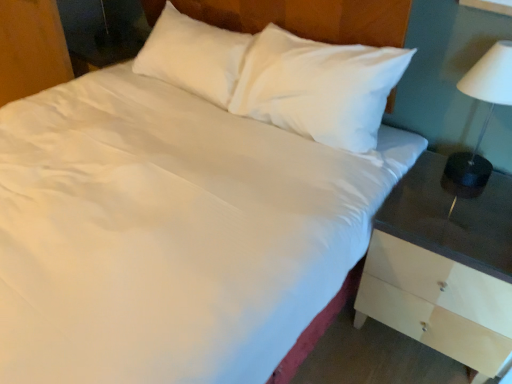
Question: Can we say wooden dresser at lower left lies outside white glossy lampshade at right?

Choices:
 (A) yes
 (B) no

Answer: (A)

Question: Is wooden dresser at lower left further to the viewer compared to white glossy lampshade at right?

Choices:
 (A) no
 (B) yes

Answer: (B)

Question: From the image's perspective, is wooden dresser at lower left under white glossy lampshade at right?

Choices:
 (A) no
 (B) yes

Answer: (A)

Question: Does wooden dresser at lower left have a lesser width compared to white glossy lampshade at right?

Choices:
 (A) yes
 (B) no

Answer: (A)

Question: Is wooden dresser at lower left smaller than white glossy lampshade at right?

Choices:
 (A) yes
 (B) no

Answer: (B)

Question: In the image, is white glossy lampshade at right positioned in front of or behind wooden dresser at lower left?

Choices:
 (A) front
 (B) behind

Answer: (A)

Question: In terms of width, does white glossy lampshade at right look wider or thinner when compared to wooden dresser at lower left?

Choices:
 (A) wide
 (B) thin

Answer: (A)

Question: Considering the positions of white glossy lampshade at right and wooden dresser at lower left in the image, is white glossy lampshade at right taller or shorter than wooden dresser at lower left?

Choices:
 (A) short
 (B) tall

Answer: (A)

Question: Considering the relative positions of white glossy lampshade at right and wooden dresser at lower left in the image provided, is white glossy lampshade at right to the left or to the right of wooden dresser at lower left?

Choices:
 (A) right
 (B) left

Answer: (A)

Question: Considering the positions of point (392, 210) and point (44, 76), is point (392, 210) closer or farther from the camera than point (44, 76)?

Choices:
 (A) farther
 (B) closer

Answer: (B)

Question: Considering the positions of white wood nightstand at right and wooden dresser at lower left in the image, is white wood nightstand at right taller or shorter than wooden dresser at lower left?

Choices:
 (A) tall
 (B) short

Answer: (B)

Question: Is white wood nightstand at right wider or thinner than wooden dresser at lower left?

Choices:
 (A) wide
 (B) thin

Answer: (A)

Question: From a real-world perspective, is white wood nightstand at right positioned above or below wooden dresser at lower left?

Choices:
 (A) above
 (B) below

Answer: (B)

Question: Is white wood nightstand at right bigger or smaller than white glossy lampshade at right?

Choices:
 (A) small
 (B) big

Answer: (B)

Question: From their relative heights in the image, would you say white wood nightstand at right is taller or shorter than white glossy lampshade at right?

Choices:
 (A) tall
 (B) short

Answer: (A)